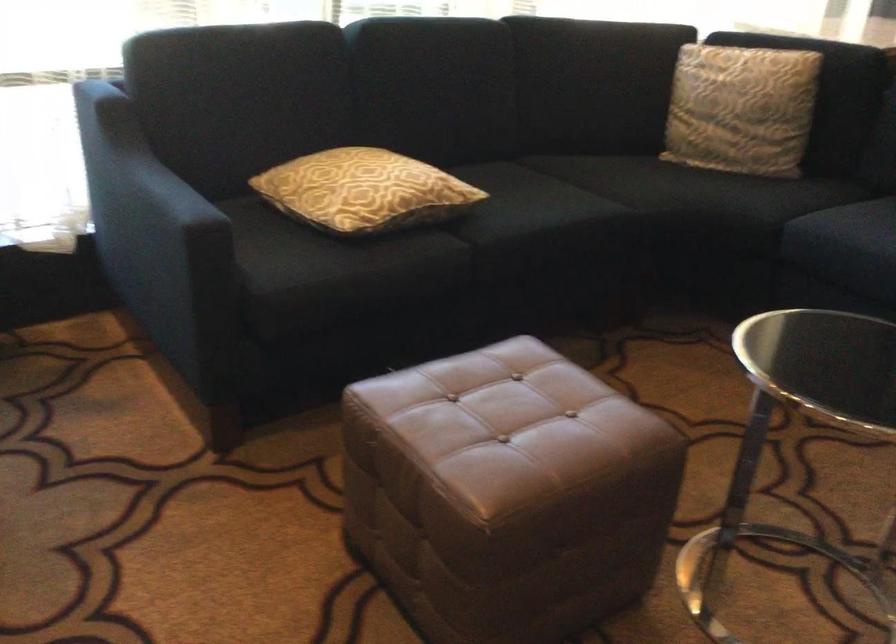
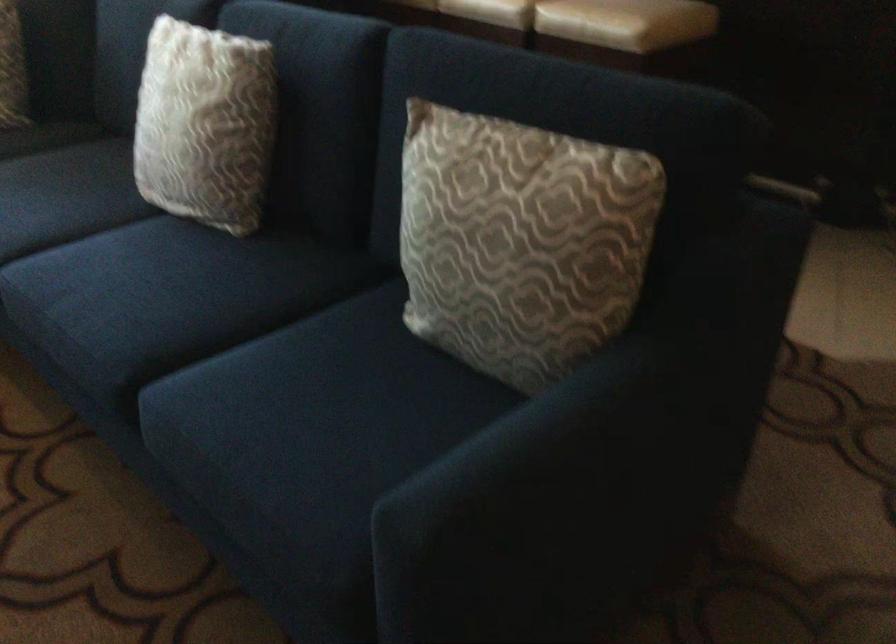
Question: The images are taken continuously from a first-person perspective. In which direction are you moving?

Choices:
 (A) Left
 (B) Right
 (C) Forward
 (D) Backward

Answer: (B)